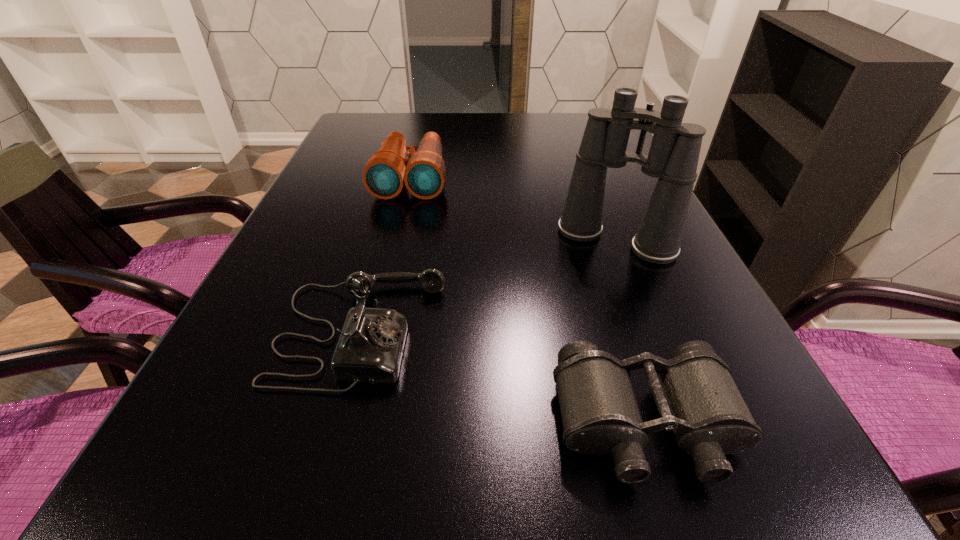
I want to click on object at the near edge, so 696,397.

Locate an element on the screen. binoculars that is at the left edge is located at coordinates (423, 172).

This screenshot has width=960, height=540. What are the coordinates of `telephone at the left edge` in the screenshot? It's located at (369, 350).

Image resolution: width=960 pixels, height=540 pixels. What are the coordinates of `object that is at the near right corner` in the screenshot? It's located at (696, 397).

In the image, there is a desktop. At what (x,y) coordinates should I click in order to perform the action: click on free space at the far edge. Please return your answer as a coordinate pair (x, y). Looking at the image, I should click on (423, 127).

Find the location of a particular element. The height and width of the screenshot is (540, 960). free region at the near edge is located at coordinates (290, 539).

Identify the location of vacant region at the left edge of the desktop. The height and width of the screenshot is (540, 960). (354, 230).

Locate an element on the screen. vacant area at the right edge is located at coordinates (742, 476).

The height and width of the screenshot is (540, 960). Find the location of `vacant space at the far left corner of the desktop`. vacant space at the far left corner of the desktop is located at coordinates (345, 143).

You are a GUI agent. You are given a task and a screenshot of the screen. Output one action in this format:
    pyautogui.click(x=<x>, y=<y>)
    Task: Click on the free region at the near left corner of the desktop
    The height and width of the screenshot is (540, 960).
    Given the screenshot: What is the action you would take?
    pyautogui.click(x=125, y=516)